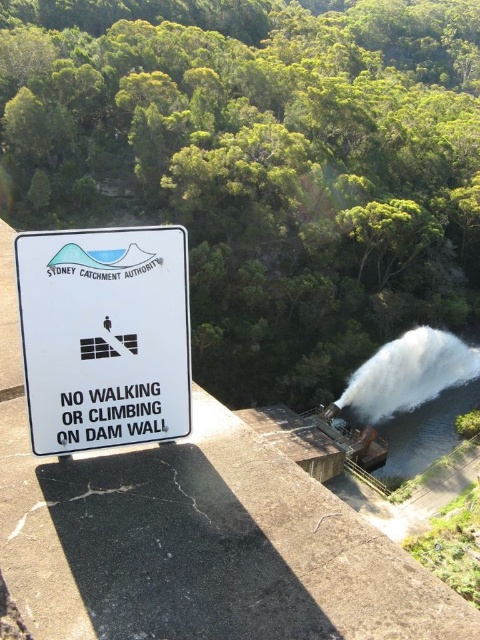
You are a drone operator tasked with capturing aerial footage of the dam wall. Your drone has a maximum flight range of 50 meters. If you are positioned at the white plastic sign at center, can you safely fly your drone to the white frothy water at center without exceeding its range?

The white plastic sign at center and white frothy water at center are 55.15 meters apart from each other. Since the drone has a maximum flight range of 50 meters, it cannot safely reach the white frothy water at center without exceeding its range.

You are a park ranger inspecting the dam area. You notice the white plastic sign at center and the white frothy water at center. Which object is located above the other?

The white plastic sign at center is positioned over the white frothy water at center, meaning the sign is above the water.

You are a park ranger at the dam and need to inform visitors about the safety rules. Which object is smaller in size between the white plastic sign at center and the white frothy water at center?

The white plastic sign at center has a smaller size compared to the white frothy water at center, so the white plastic sign at center is smaller.